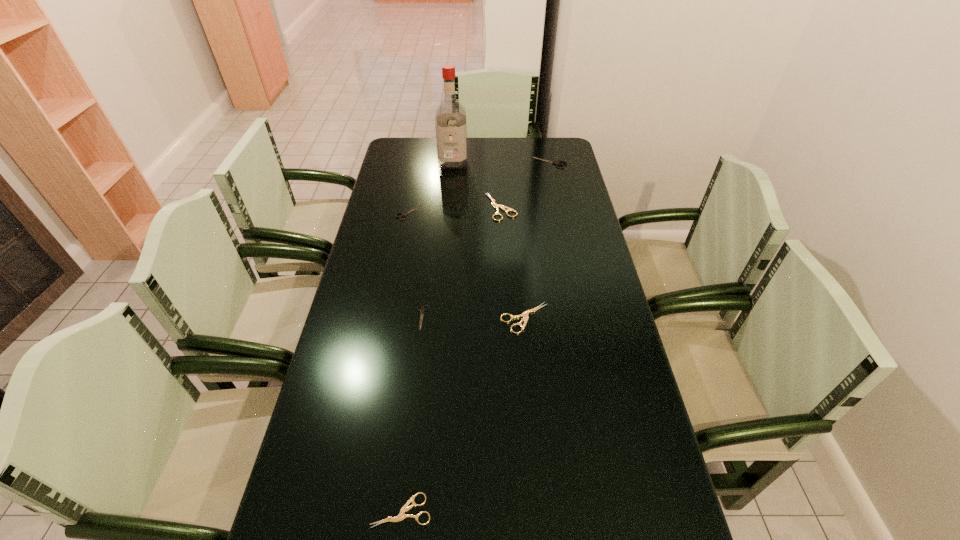
You are a GUI agent. You are given a task and a screenshot of the screen. Output one action in this format:
    pyautogui.click(x=<x>, y=<y>)
    Task: Click on the liquor
    
    Given the screenshot: What is the action you would take?
    pyautogui.click(x=450, y=120)

Where is `the farthest shears`? The image size is (960, 540). the farthest shears is located at coordinates (557, 163).

Find the location of a particular element. the rightmost black shears is located at coordinates (557, 163).

Identify the location of the farthest beige shears. This screenshot has width=960, height=540. (496, 206).

Where is `the second smallest black shears`? The width and height of the screenshot is (960, 540). the second smallest black shears is located at coordinates (406, 213).

Locate an element on the screen. the leftmost black shears is located at coordinates (406, 213).

Where is `the second nearest beige shears`? This screenshot has width=960, height=540. the second nearest beige shears is located at coordinates (525, 314).

I want to click on the nearest beige shears, so click(x=401, y=516).

Image resolution: width=960 pixels, height=540 pixels. Identify the location of the nearest shears. (401, 516).

Find the location of a particular element. the second black shears from right to left is located at coordinates (422, 310).